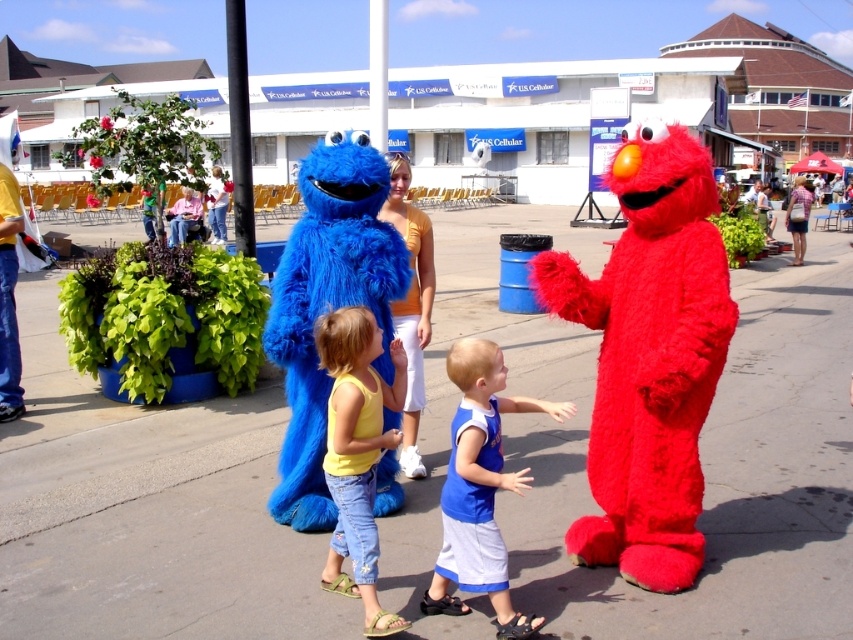
Question: Is the position of blue cotton shirt at center more distant than that of yellow cotton tank top at center?

Choices:
 (A) yes
 (B) no

Answer: (B)

Question: Does yellow cotton tank top at center come in front of denim shorts at center?

Choices:
 (A) no
 (B) yes

Answer: (B)

Question: Is blue furry cookie monster at center smaller than blue cotton shirt at center?

Choices:
 (A) yes
 (B) no

Answer: (A)

Question: Estimate the real-world distances between objects in this image. Which object is farther from the blue cotton shirt at center?

Choices:
 (A) denim shorts at center
 (B) denim shorts at lower right

Answer: (A)

Question: Which of the following is the farthest from the observer?

Choices:
 (A) denim shorts at lower right
 (B) fuzzy red elmo at right

Answer: (A)

Question: Which object is the closest to the yellow cotton tank top at center?

Choices:
 (A) blue furry cookie monster at center
 (B) denim shorts at center
 (C) fuzzy red elmo at right
 (D) yellow cotton shirt at center

Answer: (D)